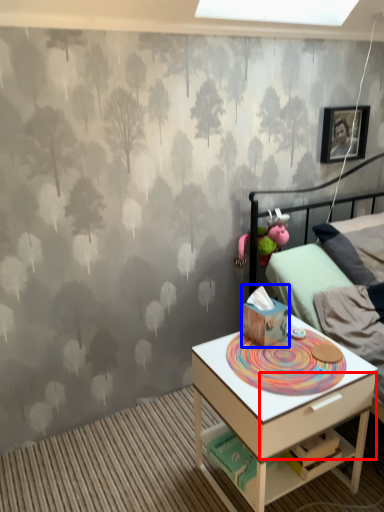
Question: Which of the following is the closest to the observer, drawer (highlighted by a red box) or toy (highlighted by a blue box)?

Choices:
 (A) drawer
 (B) toy

Answer: (A)